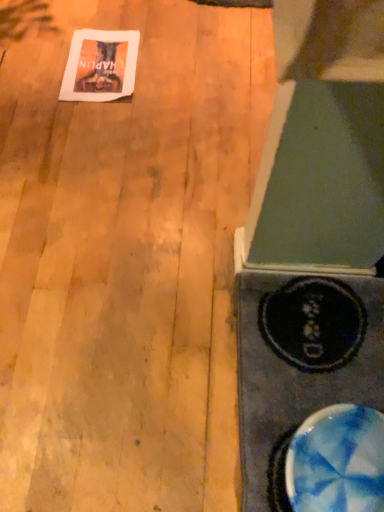
Identify the location of vacant space underneath white paper at upper left (from a real-world perspective). (102, 73).